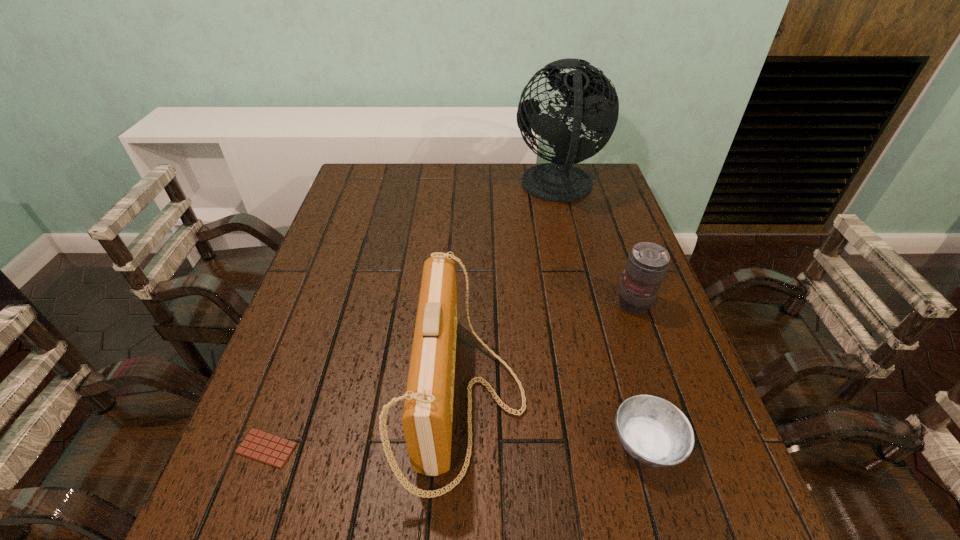
This screenshot has height=540, width=960. I want to click on vacant region between the farthest object and the second tallest object, so click(511, 294).

At what (x,y) coordinates should I click in order to perform the action: click on blank region between the ashtray and the shortest object. Please return your answer as a coordinate pair (x, y). Image resolution: width=960 pixels, height=540 pixels. Looking at the image, I should click on (457, 446).

You are a GUI agent. You are given a task and a screenshot of the screen. Output one action in this format:
    pyautogui.click(x=<x>, y=<y>)
    Task: Click on the blank region between the farthest object and the second object from left to right
    The width and height of the screenshot is (960, 540).
    Given the screenshot: What is the action you would take?
    tap(511, 294)

Identify the location of free space between the farthest object and the handbag. (511, 294).

Find the location of a particular element. empty location between the second object from left to right and the fourth tallest object is located at coordinates (556, 421).

Locate an element on the screen. the third closest object relative to the second tallest object is located at coordinates (647, 264).

You are a GUI agent. You are given a task and a screenshot of the screen. Output one action in this format:
    pyautogui.click(x=<x>, y=<y>)
    Task: Click on the object that is the third closest one to the handbag
    
    Given the screenshot: What is the action you would take?
    [x=647, y=264]

I want to click on blank space that satisfies the following two spatial constraints: 1. on the front-facing side of the farthest object; 2. on the front side of the candy bar, so click(x=620, y=448).

Find the location of a particular element. The width and height of the screenshot is (960, 540). free space that satisfies the following two spatial constraints: 1. on the decorative side of the ashtray; 2. on the left side of the second tallest object is located at coordinates pyautogui.click(x=464, y=444).

At what (x,y) coordinates should I click in order to perform the action: click on vacant space that satisfies the following two spatial constraints: 1. on the back side of the fourth tallest object; 2. on the decorative side of the handbag. Please return your answer as a coordinate pair (x, y). This screenshot has width=960, height=540. Looking at the image, I should click on (634, 399).